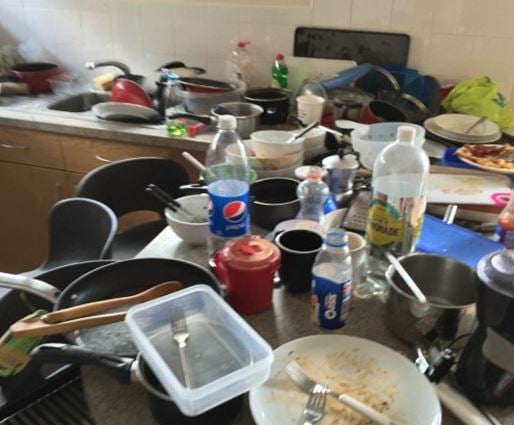
Image resolution: width=514 pixels, height=425 pixels. I want to click on cooking utensils, so pos(82,323), pos(87,309).